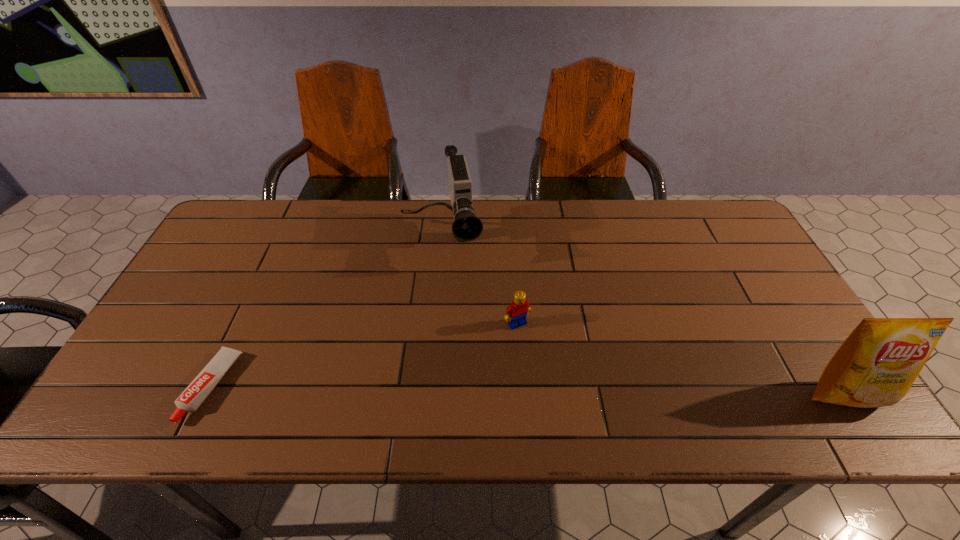
At what (x,y) coordinates should I click in order to perform the action: click on free space on the desktop that is between the leftmost object and the crisp (potato chip) and is positioned on the recording direction of the camcorder. Please return your answer as a coordinate pair (x, y). Image resolution: width=960 pixels, height=540 pixels. Looking at the image, I should click on (465, 389).

Identify the location of free spot on the desktop that is between the toothpaste and the crisp (potato chip) and is positioned on the front-facing side of the Lego. (562, 390).